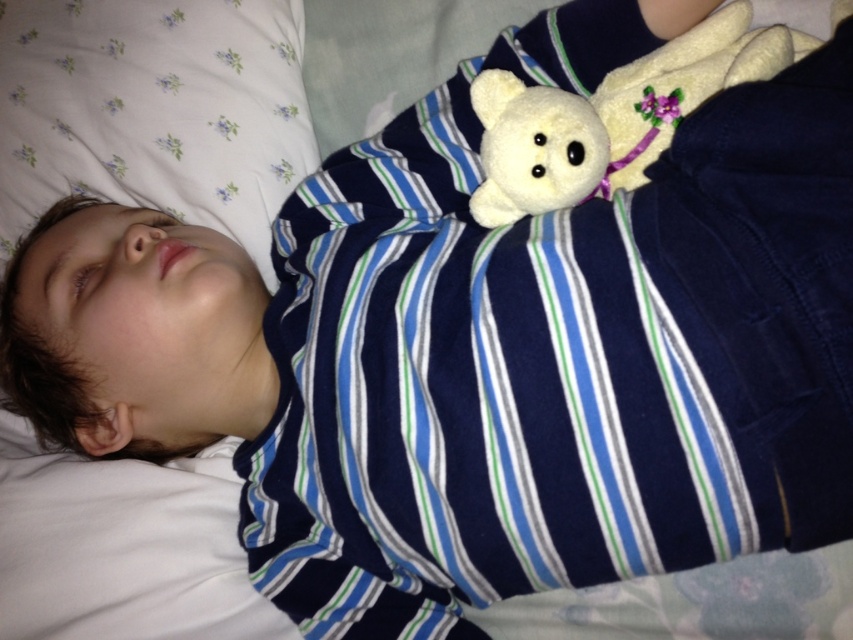
Question: Does white soft pillow at upper left have a larger size compared to white plush bear at upper right?

Choices:
 (A) yes
 (B) no

Answer: (A)

Question: Is white soft pillow at upper left positioned in front of white plush bear at upper right?

Choices:
 (A) yes
 (B) no

Answer: (B)

Question: Which point appears closest to the camera in this image?

Choices:
 (A) (285, 625)
 (B) (610, 140)

Answer: (B)

Question: Which point is closer to the camera?

Choices:
 (A) white plush bear at upper right
 (B) white soft pillow at upper left

Answer: (A)

Question: Can you confirm if white soft pillow at upper left is smaller than white plush bear at upper right?

Choices:
 (A) yes
 (B) no

Answer: (B)